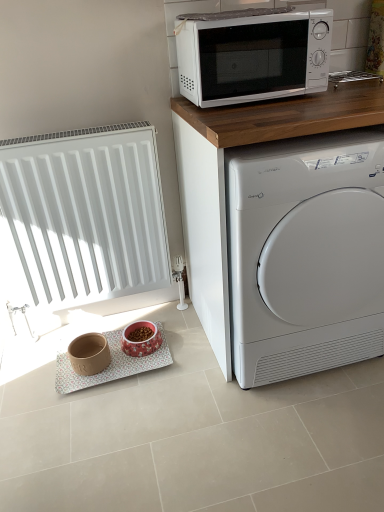
Locate an element on the screen. This screenshot has width=384, height=512. free point below white matte radiator at left (from a real-world perspective) is located at coordinates (109, 320).